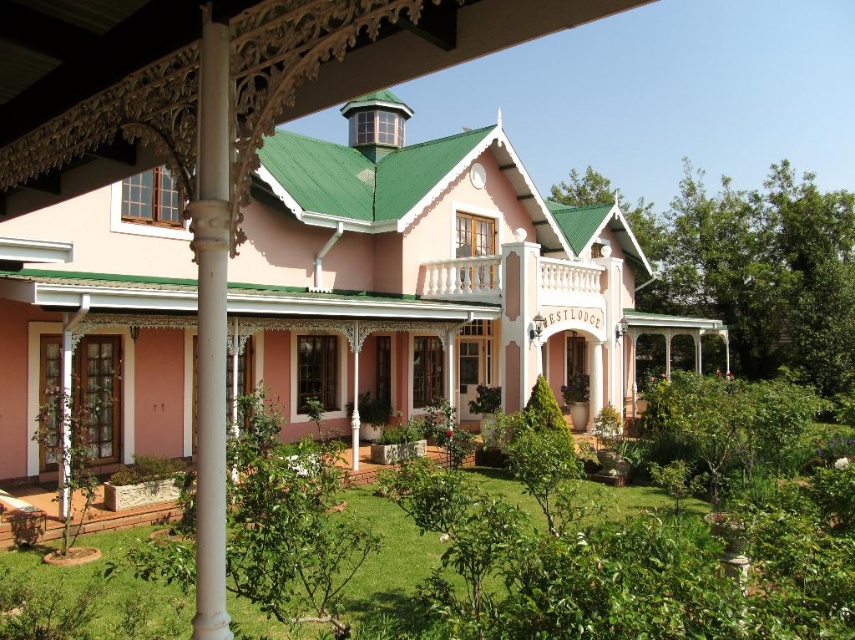
Question: Is green leafy shrubs at center to the right of white carved wood column at center from the viewer's perspective?

Choices:
 (A) no
 (B) yes

Answer: (B)

Question: Which of the following is the closest to the observer?

Choices:
 (A) white carved wood column at center
 (B) green leafy shrubs at center

Answer: (A)

Question: Which point is closer to the camera taking this photo?

Choices:
 (A) (207, 205)
 (B) (343, 516)

Answer: (A)

Question: Is the position of green leafy shrubs at center less distant than that of white carved wood column at center?

Choices:
 (A) no
 (B) yes

Answer: (A)

Question: Does green leafy shrubs at center appear on the right side of white carved wood column at center?

Choices:
 (A) no
 (B) yes

Answer: (B)